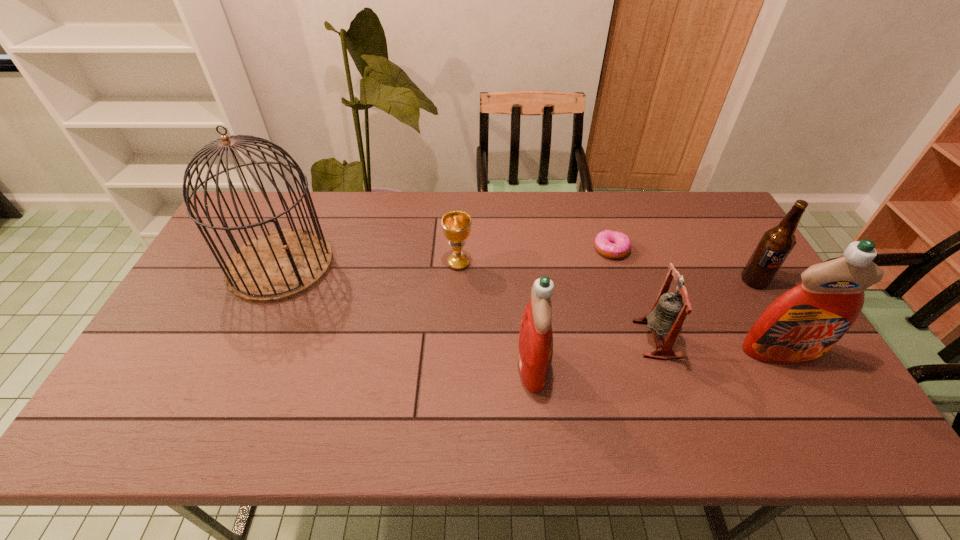
Point out which object is positioned as the fourth nearest to the second object from left to right. Please provide its 2D coordinates. Your answer should be formatted as a tuple, i.e. [(x, y)], where the tuple contains the x and y coordinates of a point satisfying the conditions above.

[(669, 311)]

Locate an element on the screen. object that stands as the sixth closest to the bell is located at coordinates (279, 265).

This screenshot has width=960, height=540. I want to click on vacant area in the image that satisfies the following two spatial constraints: 1. on the label of the beer bottle; 2. on the front surface of the third object from left to right, so click(x=804, y=364).